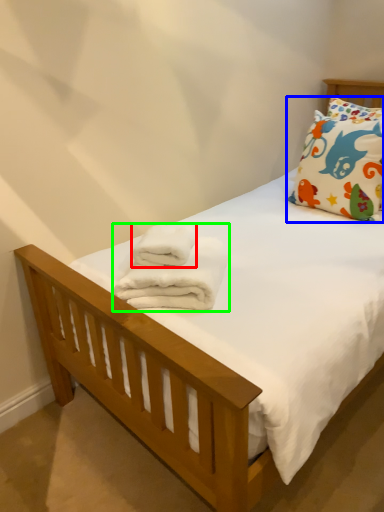
Question: Estimate the real-world distances between objects in this image. Which object is farther from bath towel (highlighted by a red box), pillow (highlighted by a blue box) or bath towel (highlighted by a green box)?

Choices:
 (A) pillow
 (B) bath towel

Answer: (A)